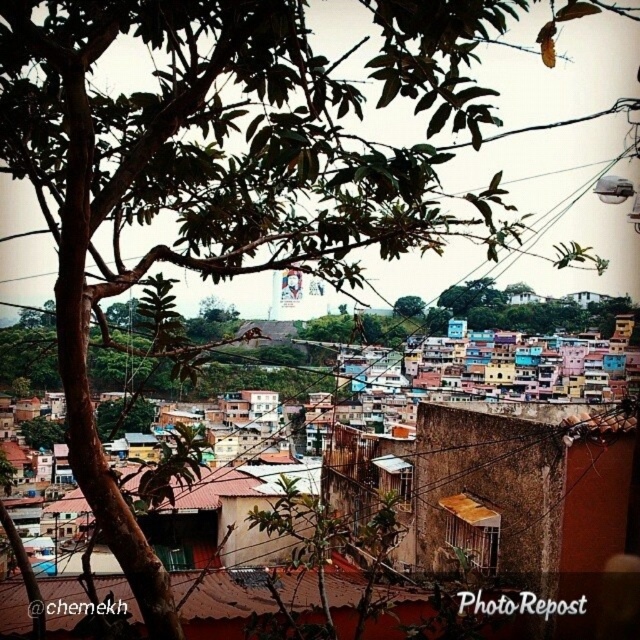
Question: Which object appears farthest from the camera in this image?

Choices:
 (A) green leafy tree at center
 (B) brown textured wall at center

Answer: (A)

Question: Which point is farther to the camera?

Choices:
 (A) green leafy tree at center
 (B) brown textured wall at center

Answer: (A)

Question: Does brown textured wall at center appear on the right side of green leafy tree at center?

Choices:
 (A) yes
 (B) no

Answer: (B)

Question: Can you confirm if brown textured wall at center is smaller than green leafy tree at center?

Choices:
 (A) yes
 (B) no

Answer: (B)

Question: Can you confirm if brown textured wall at center is smaller than green leafy tree at center?

Choices:
 (A) no
 (B) yes

Answer: (A)